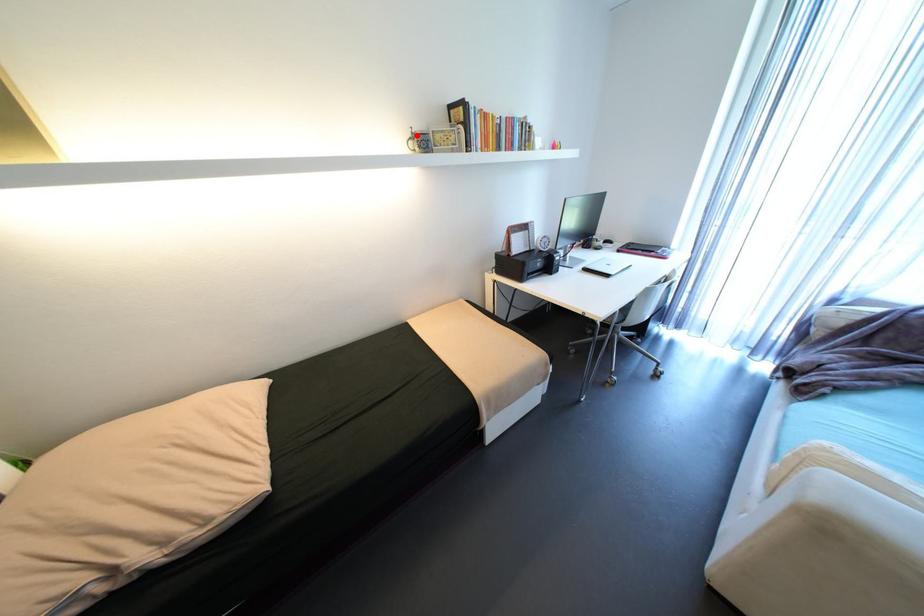
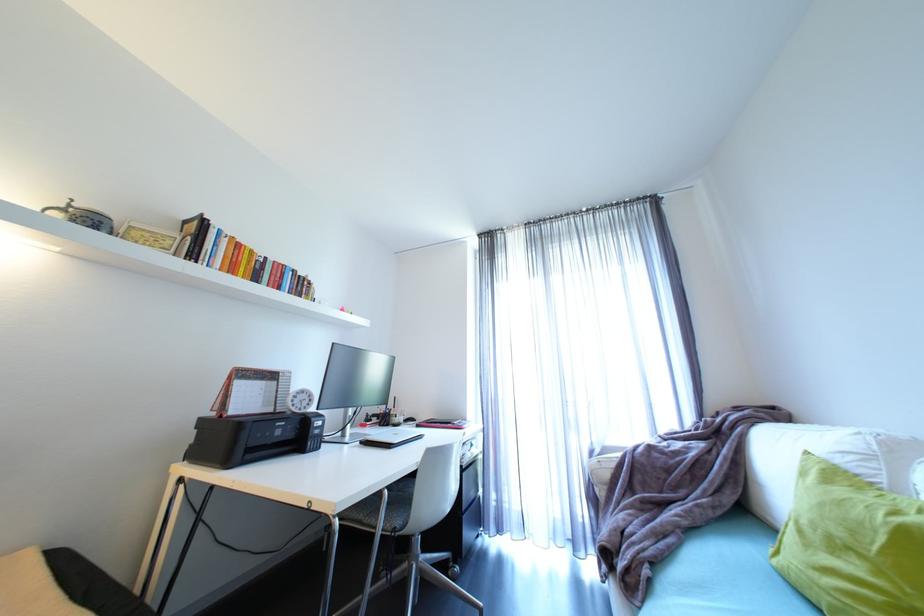
The point at the highlighted location is marked in the first image. Where is the corresponding point in the second image?

(69, 206)